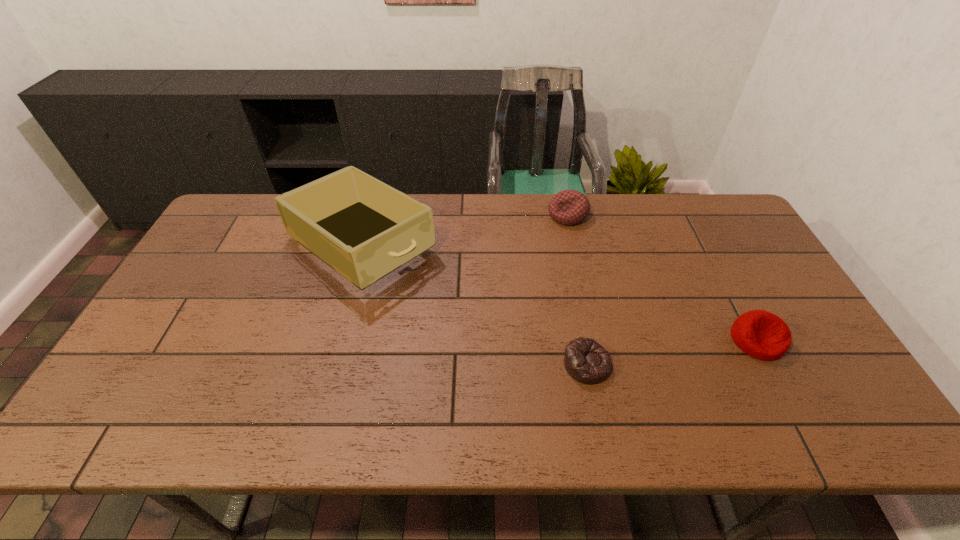
Locate an element on the screen. box is located at coordinates (364, 229).

Locate an element on the screen. the leftmost object is located at coordinates (364, 229).

Where is `the farthest beanbag`? The image size is (960, 540). the farthest beanbag is located at coordinates (569, 207).

In order to click on the rightmost object in this screenshot , I will do `click(760, 334)`.

At what (x,y) coordinates should I click in order to perform the action: click on the shortest object. Please return your answer as a coordinate pair (x, y). The height and width of the screenshot is (540, 960). Looking at the image, I should click on (586, 361).

Where is `free space located on the left of the tallest object`? The image size is (960, 540). free space located on the left of the tallest object is located at coordinates click(x=218, y=244).

Identify the location of vacant space located 0.160m on the front of the farthest beanbag. Image resolution: width=960 pixels, height=540 pixels. (578, 262).

You are a GUI agent. You are given a task and a screenshot of the screen. Output one action in this format:
    pyautogui.click(x=<x>, y=<y>)
    Task: Click on the free region located 0.150m on the seat area of the rightmost beanbag
    This screenshot has height=540, width=960.
    Given the screenshot: What is the action you would take?
    pyautogui.click(x=799, y=420)

I want to click on free space located on the right of the shortest beanbag, so click(715, 364).

You are a GUI agent. You are given a task and a screenshot of the screen. Output one action in this format:
    pyautogui.click(x=<x>, y=<y>)
    Task: Click on the box located in the far edge section of the desktop
    
    Given the screenshot: What is the action you would take?
    pyautogui.click(x=364, y=229)